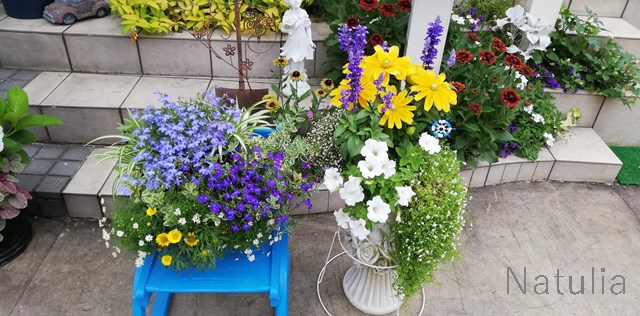
In order to click on black vase in this screenshot , I will do `click(20, 239)`.